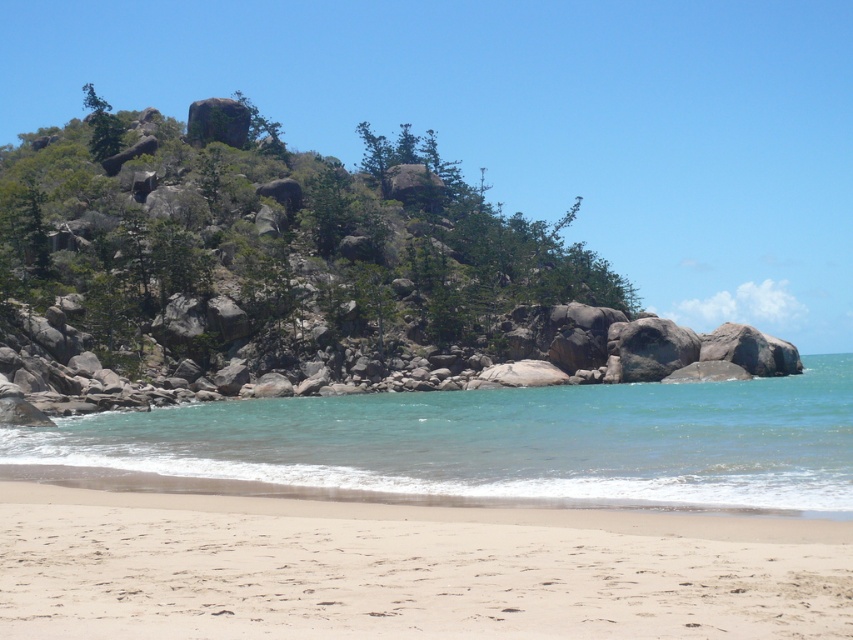
You are standing on the light beige sand at lower center and want to reach the clear blue water at lower center. Which direction should you move to get there?

To reach the clear blue water at lower center from the light beige sand at lower center, you should move downward since the sand is above the water.

You are a beachcomber looking for a spot to set up your umbrella. The light beige sand at lower center and the clear blue water at lower center are both in your view. Which area has more space to accommodate your umbrella setup?

The clear blue water at lower center occupies more space than the light beige sand at lower center, so the clear blue water at lower center would have more space for the umbrella setup.